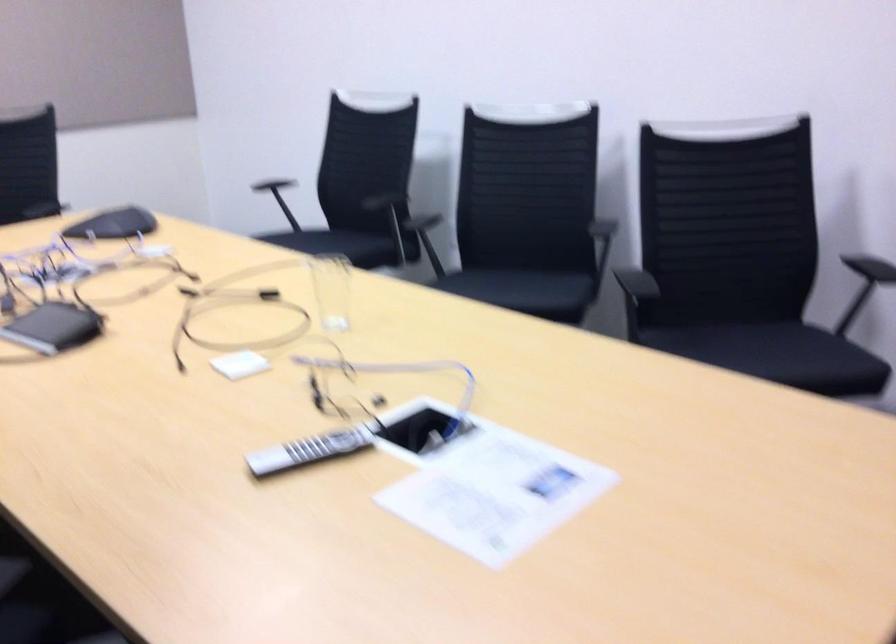
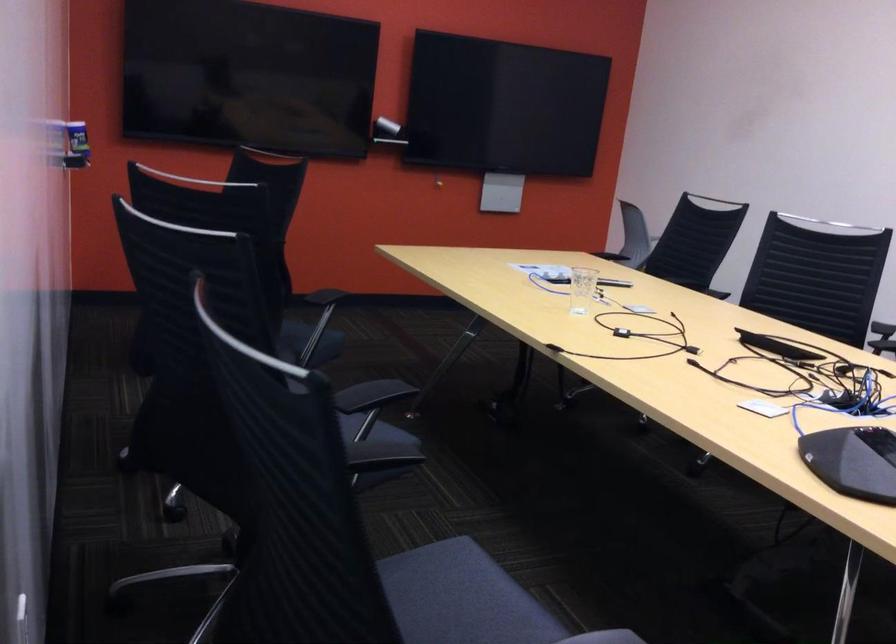
The point at (444, 283) is marked in the first image. Where is the corresponding point in the second image?

(374, 430)